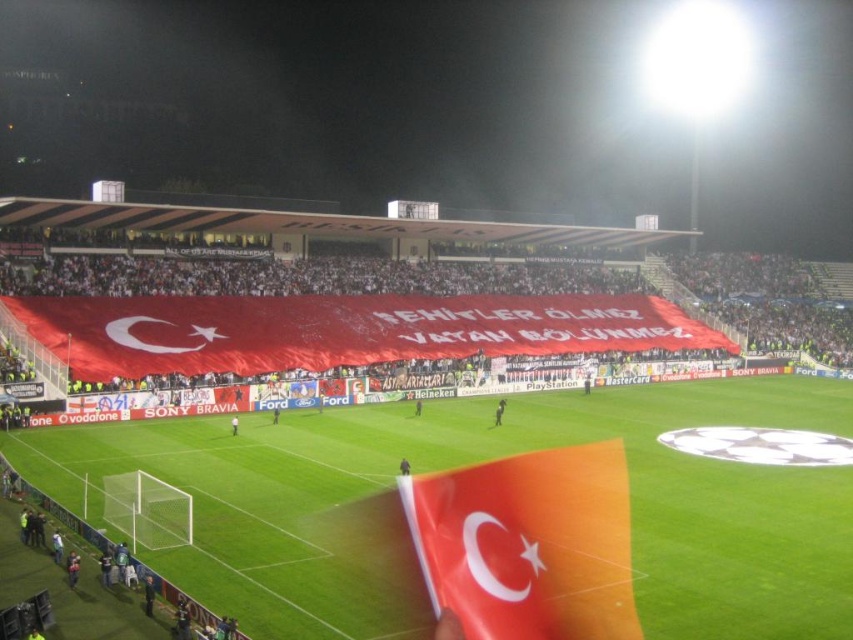
Between dark blue fabric at center and dark green jersey at center, which one is positioned higher?

dark green jersey at center is higher up.

Is dark blue fabric at center further to camera compared to dark green jersey at center?

No.

You are a GUI agent. You are given a task and a screenshot of the screen. Output one action in this format:
    pyautogui.click(x=<x>, y=<y>)
    Task: Click on the dark blue fabric at center
    
    Given the screenshot: What is the action you would take?
    pyautogui.click(x=404, y=467)

Can you confirm if matte orange flag at lower right is positioned below smooth black shirt at center?

Yes.

Does matte orange flag at lower right lie in front of smooth black shirt at center?

Yes.

Which is in front, point (622, 596) or point (496, 422)?

Point (622, 596)

You are a GUI agent. You are given a task and a screenshot of the screen. Output one action in this format:
    pyautogui.click(x=<x>, y=<y>)
    Task: Click on the matte orange flag at lower right
    
    Given the screenshot: What is the action you would take?
    pyautogui.click(x=527, y=544)

Who is lower down, green grass football field at center or dark blue fabric at center?

green grass football field at center is below.

Between point (699, 531) and point (404, 460), which one is positioned in front?

Point (699, 531) is more forward.

The image size is (853, 640). I want to click on green grass football field at center, so click(x=476, y=461).

Identify the location of green grass football field at center. (476, 461).